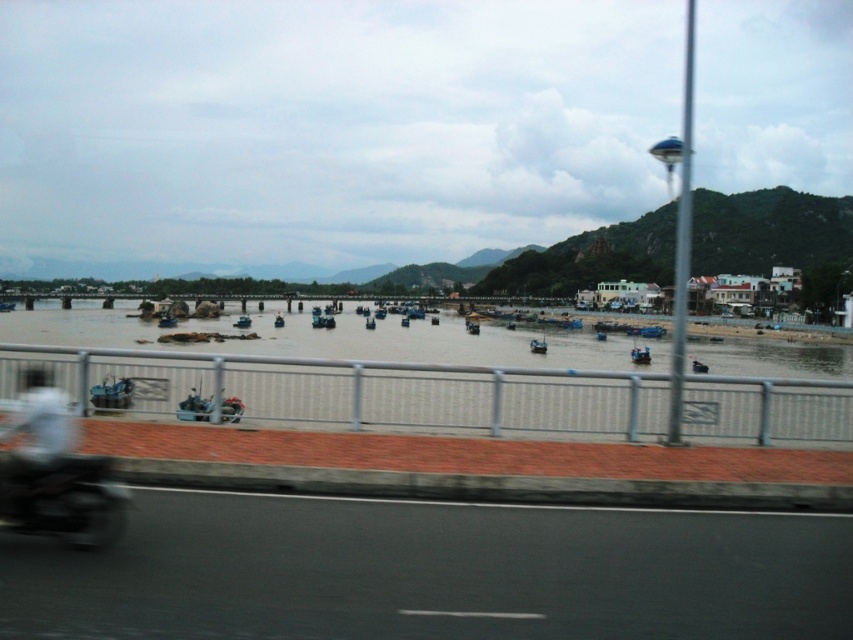
Is black asphalt road at lower center closer to camera compared to metallic gray fence at lower center?

Yes, black asphalt road at lower center is in front of metallic gray fence at lower center.

Describe the element at coordinates (433, 572) in the screenshot. This screenshot has width=853, height=640. I see `black asphalt road at lower center` at that location.

Does point (492, 589) lie in front of point (831, 385)?

Yes, it is.

Find the location of `black asphalt road at lower center`. black asphalt road at lower center is located at coordinates (433, 572).

Is metallic gray fence at lower center to the right of white matte helmet at upper left from the viewer's perspective?

Correct, you'll find metallic gray fence at lower center to the right of white matte helmet at upper left.

Based on the photo, does metallic gray fence at lower center have a lesser height compared to white matte helmet at upper left?

In fact, metallic gray fence at lower center may be taller than white matte helmet at upper left.

Which is in front, point (410, 394) or point (61, 401)?

Point (61, 401)

What are the coordinates of `metallic gray fence at lower center` in the screenshot? It's located at (355, 392).

Who is taller, black asphalt road at lower center or shiny black motorcycle at lower left?

Standing taller between the two is shiny black motorcycle at lower left.

Looking at this image, which is below, black asphalt road at lower center or shiny black motorcycle at lower left?

black asphalt road at lower center

Image resolution: width=853 pixels, height=640 pixels. Find the location of `black asphalt road at lower center`. black asphalt road at lower center is located at coordinates (433, 572).